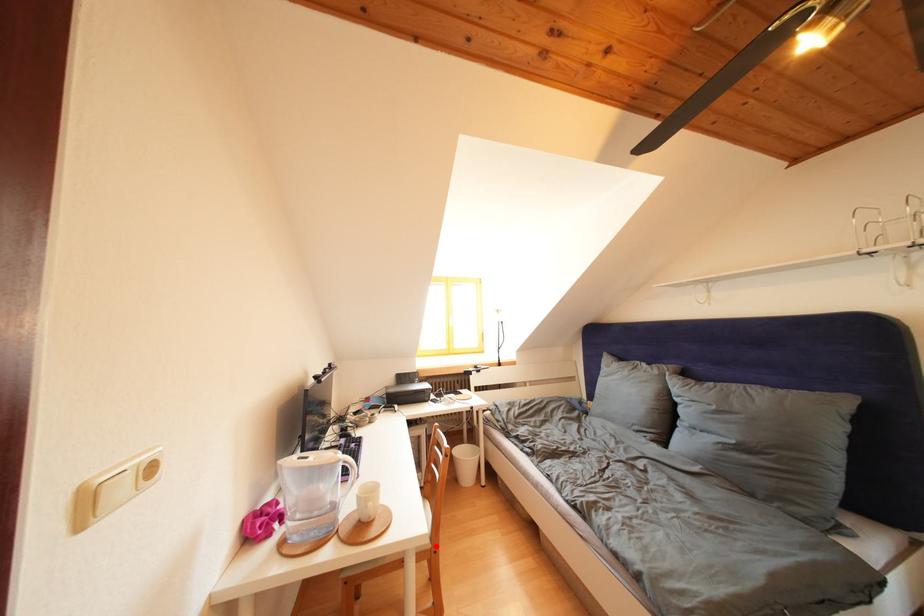
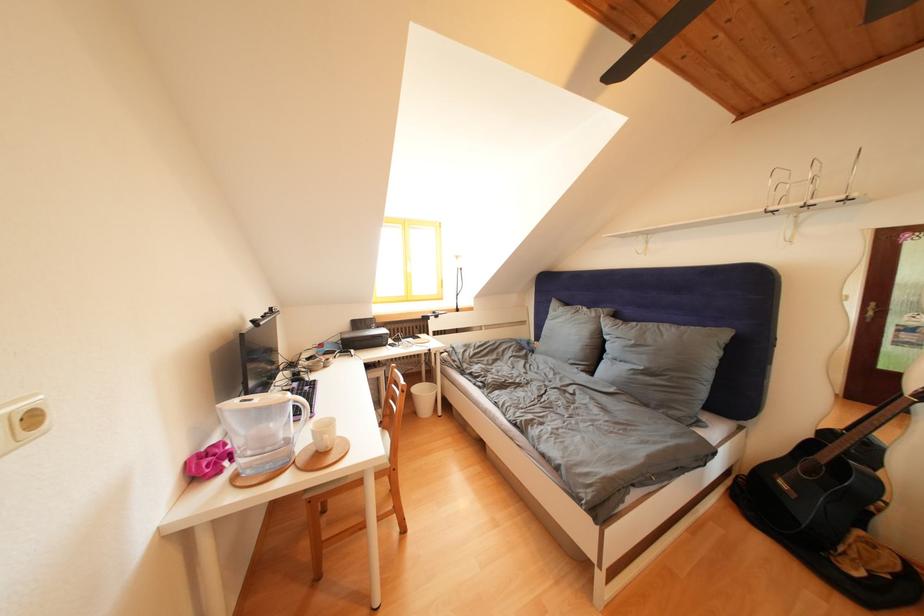
Find the pixel in the second image that matches the highlighted location in the first image.

(395, 467)